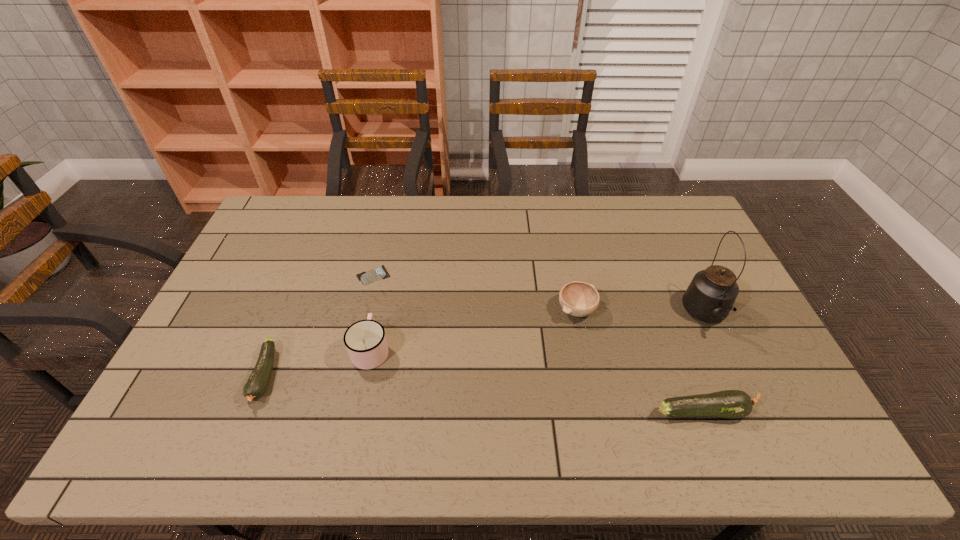
Locate an element on the screen. vacant space at the left edge of the desktop is located at coordinates (243, 259).

The image size is (960, 540). In the image, there is a desktop. Find the location of `blank space at the right edge`. blank space at the right edge is located at coordinates (766, 356).

The height and width of the screenshot is (540, 960). I want to click on vacant space at the near left corner of the desktop, so click(221, 393).

Image resolution: width=960 pixels, height=540 pixels. In order to click on vacant space at the far right corner in this screenshot , I will do `click(691, 211)`.

At what (x,y) coordinates should I click in order to perform the action: click on unoccupied area between the shorter zucchini and the mug. Please return your answer as a coordinate pair (x, y). This screenshot has width=960, height=540. Looking at the image, I should click on (319, 362).

The image size is (960, 540). What are the coordinates of `empty space that is in between the left zucchini and the farthest object` in the screenshot? It's located at pos(320,325).

Find the location of a particular element. This screenshot has height=540, width=960. free space between the leftmost object and the right zucchini is located at coordinates (484, 393).

Where is `free space between the tallest object and the identity card`? Image resolution: width=960 pixels, height=540 pixels. free space between the tallest object and the identity card is located at coordinates (540, 295).

You are a GUI agent. You are given a task and a screenshot of the screen. Output one action in this format:
    pyautogui.click(x=<x>, y=<y>)
    Task: Click on the free space that is in between the shorter zucchini and the taller zucchini
    Image resolution: width=960 pixels, height=540 pixels.
    Given the screenshot: What is the action you would take?
    pyautogui.click(x=484, y=393)

Find the location of a particular element. Image resolution: width=960 pixels, height=540 pixels. vacant area that lies between the leftmost object and the taller zucchini is located at coordinates (484, 393).